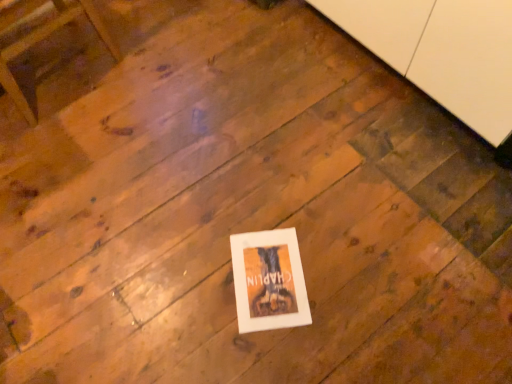
This screenshot has width=512, height=384. Identify the location of empty space that is in between wooden chair at upper left and white paper at center. (153, 159).